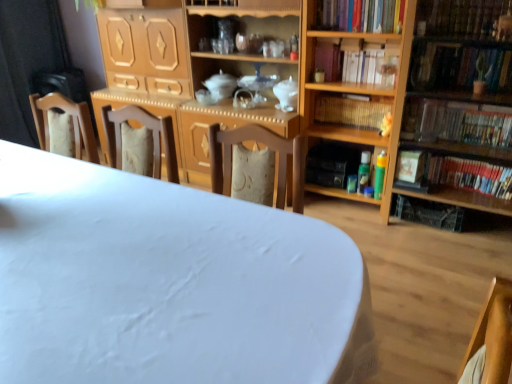
Question: From the image's perspective, is wooden bookshelf at right, marked as the 1th shelf in a right-to-left arrangement, located above or below hardcover book at right, the second book ordered from the bottom?

Choices:
 (A) below
 (B) above

Answer: (B)

Question: Based on their sizes in the image, would you say wooden bookshelf at right, positioned as the 2th shelf in left-to-right order, is bigger or smaller than hardcover book at right, which is counted as the fifth book, starting from the top?

Choices:
 (A) big
 (B) small

Answer: (A)

Question: Which object is positioned farthest from the green matte plant at upper right, the 3th book from the top?

Choices:
 (A) wooden bookshelf at right, marked as the 1th shelf in a right-to-left arrangement
 (B) white matte table at center
 (C) wooden chair at left
 (D) wooden bookshelf at center, positioned as the third book in bottom-to-top order
 (E) hardcover book at right

Answer: (C)

Question: Which object is the closest to the hardcover books at upper right, which is counted as the 2th book, starting from the top?

Choices:
 (A) wooden bookshelf at center, positioned as the third book in bottom-to-top order
 (B) wooden bookshelf at right, marked as the 1th shelf in a right-to-left arrangement
 (C) white matte table at center
 (D) wooden bookshelf at right, the first shelf viewed from the left
 (E) hardcover book at right

Answer: (D)